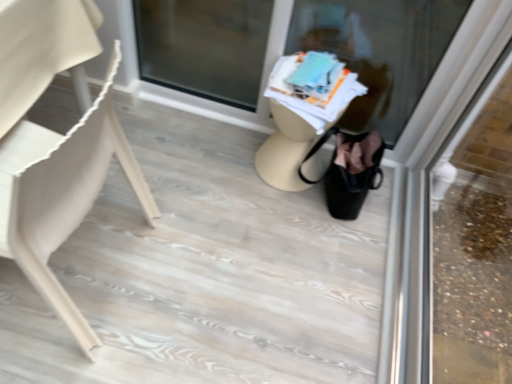
The height and width of the screenshot is (384, 512). I want to click on free spot below matte beige chair at left (from a real-world perspective), so click(75, 265).